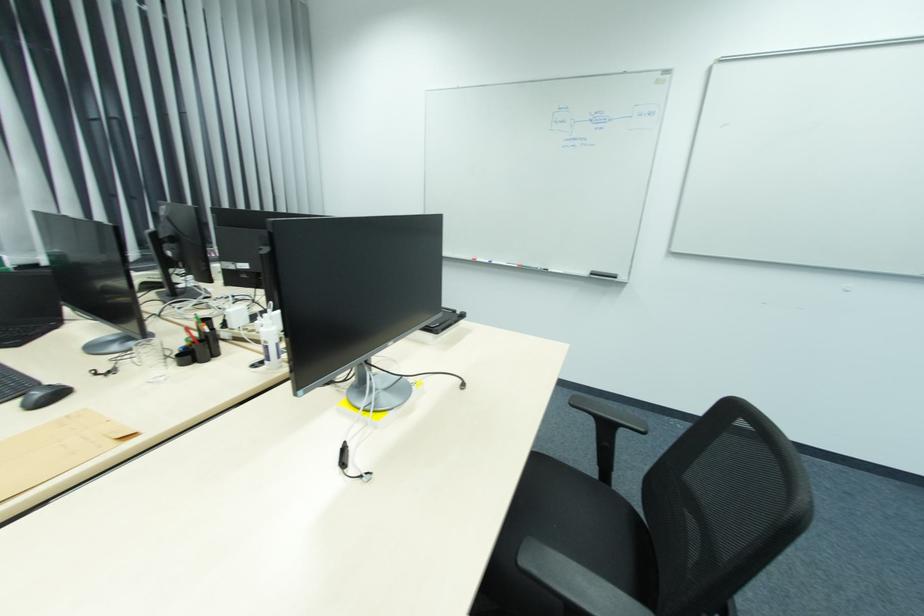
Find where to push the white bottle pump. Please return your answer as a coordinate pair (x, y).

(270, 338)